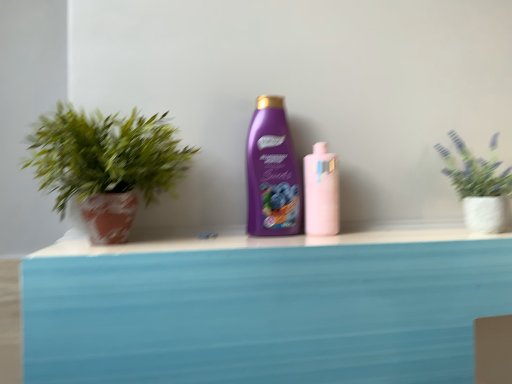
Question: Does green leafy plant in textured pot at upper right, the 1th houseplant viewed from the right, turn towards green matte plant at left, the 1th houseplant viewed from the left?

Choices:
 (A) no
 (B) yes

Answer: (A)

Question: From the image's perspective, would you say green leafy plant in textured pot at upper right, the 1th houseplant viewed from the right, is positioned over green matte plant at left, the 1th houseplant viewed from the left?

Choices:
 (A) no
 (B) yes

Answer: (A)

Question: Is green leafy plant in textured pot at upper right, which is the second houseplant from left to right, in contact with green matte plant at left, placed as the 2th houseplant when sorted from right to left?

Choices:
 (A) yes
 (B) no

Answer: (B)

Question: Is green matte plant at left, the 1th houseplant viewed from the left, at the back of green leafy plant in textured pot at upper right, which is the second houseplant from left to right?

Choices:
 (A) yes
 (B) no

Answer: (B)

Question: Is green leafy plant in textured pot at upper right, the 1th houseplant viewed from the right, positioned behind green matte plant at left, placed as the 2th houseplant when sorted from right to left?

Choices:
 (A) no
 (B) yes

Answer: (B)

Question: In terms of height, does pink glossy bottle at center, which appears as the 2th bottle when viewed from the left, look taller or shorter compared to green matte plant at left, the 1th houseplant viewed from the left?

Choices:
 (A) short
 (B) tall

Answer: (A)

Question: From the image's perspective, relative to green matte plant at left, the 1th houseplant viewed from the left, is pink glossy bottle at center, the 1th bottle when ordered from right to left, above or below?

Choices:
 (A) above
 (B) below

Answer: (B)

Question: Is pink glossy bottle at center, which appears as the 2th bottle when viewed from the left, bigger or smaller than green matte plant at left, placed as the 2th houseplant when sorted from right to left?

Choices:
 (A) big
 (B) small

Answer: (B)

Question: In the image, is pink glossy bottle at center, the 1th bottle when ordered from right to left, positioned in front of or behind green matte plant at left, the 1th houseplant viewed from the left?

Choices:
 (A) front
 (B) behind

Answer: (B)

Question: Based on their positions, is purple glossy shampoo at center, the first bottle in the left-to-right sequence, located to the left or right of green leafy plant in textured pot at upper right, which is the second houseplant from left to right?

Choices:
 (A) left
 (B) right

Answer: (A)

Question: From a real-world perspective, is purple glossy shampoo at center, the first bottle in the left-to-right sequence, above or below green leafy plant in textured pot at upper right, which is the second houseplant from left to right?

Choices:
 (A) above
 (B) below

Answer: (A)

Question: Relative to green leafy plant in textured pot at upper right, which is the second houseplant from left to right, is purple glossy shampoo at center, the first bottle in the left-to-right sequence, in front or behind?

Choices:
 (A) behind
 (B) front

Answer: (A)

Question: From the image's perspective, relative to green leafy plant in textured pot at upper right, which is the second houseplant from left to right, is purple glossy shampoo at center, the 2th bottle viewed from the right, above or below?

Choices:
 (A) above
 (B) below

Answer: (A)

Question: Considering the positions of green leafy plant in textured pot at upper right, the 1th houseplant viewed from the right, and pink glossy bottle at center, which appears as the 2th bottle when viewed from the left, in the image, is green leafy plant in textured pot at upper right, the 1th houseplant viewed from the right, bigger or smaller than pink glossy bottle at center, which appears as the 2th bottle when viewed from the left,?

Choices:
 (A) big
 (B) small

Answer: (A)

Question: From the image's perspective, is green leafy plant in textured pot at upper right, which is the second houseplant from left to right, above or below pink glossy bottle at center, which appears as the 2th bottle when viewed from the left?

Choices:
 (A) above
 (B) below

Answer: (A)